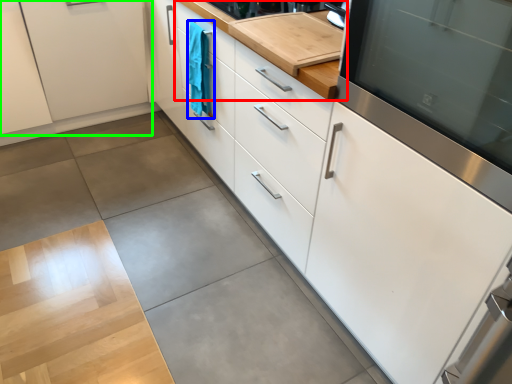
Question: Estimate the real-world distances between objects in this image. Which object is closer to countertop (highlighted by a red box), laundry (highlighted by a blue box) or cabinetry (highlighted by a green box)?

Choices:
 (A) laundry
 (B) cabinetry

Answer: (A)